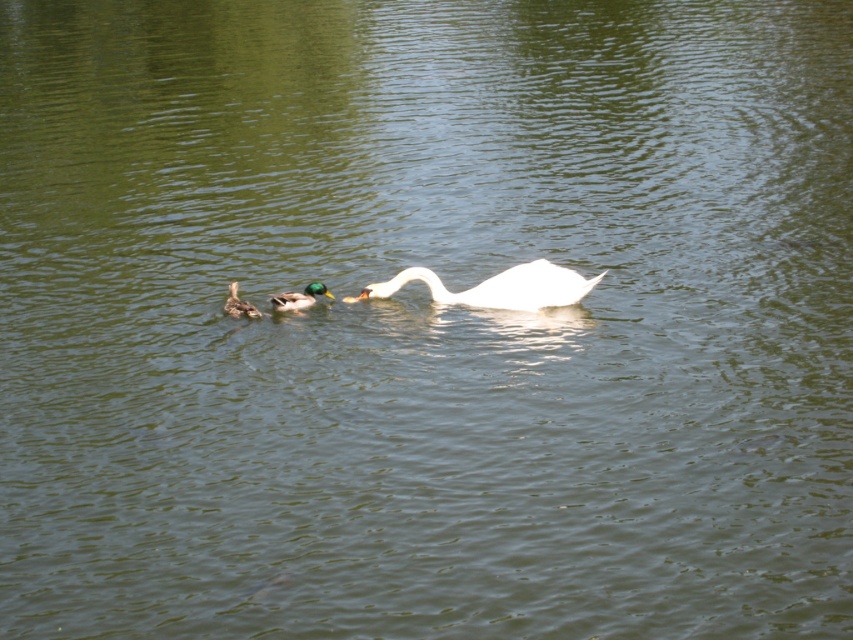
You are standing at the edge of the lake and see two points in the water. One is at point (465, 296) and the other is at point (305, 304). Which point is closer to you?

Point (465, 296) is further to the viewer than point (305, 304), so the point closer to you is point (305, 304).

In the scene shown: You are standing on the dock and see the white glossy swan at center and the brown matte duckling at lower left. Which one is closer to the dock?

The brown matte duckling at lower left is closer to the dock because it is positioned under the white glossy swan at center, which is further away.

You are standing at the camera position and want to reach the point marked at coordinates point [312,296]. If you can walk 10 feet per minute, how many minutes will it take you to reach that point?

The distance between you and the point [312,296] is 36.43 feet. At a walking speed of 10 feet per minute, it would take approximately 3.64 minutes to reach the point. Since you can walk 10 feet each minute, 36.43 divided by 10 equals 3.64 minutes.